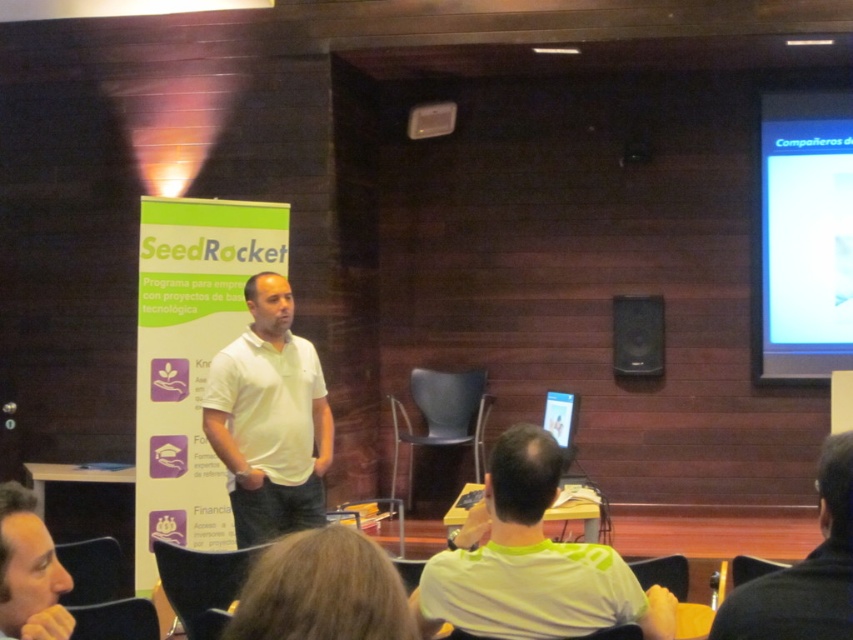
Question: Can you confirm if matte white projector screen at upper right is positioned to the right of black fabric shirt at lower right?

Choices:
 (A) no
 (B) yes

Answer: (B)

Question: Which object is positioned closest to the black fabric shirt at lower right?

Choices:
 (A) light brown hair at lower left
 (B) white matte shirt at center

Answer: (A)

Question: Which point is farther from the camera taking this photo?

Choices:
 (A) (621, 346)
 (B) (38, 544)
 (C) (434, 566)
 (D) (824, 493)

Answer: (A)

Question: Where is matte white projector screen at upper right located in relation to white matte shirt at center in the image?

Choices:
 (A) left
 (B) right

Answer: (B)

Question: Is the position of yellow matte shirt at center more distant than that of black plastic speaker at upper center?

Choices:
 (A) yes
 (B) no

Answer: (B)

Question: Which object appears closest to the camera in this image?

Choices:
 (A) black plastic speaker at upper center
 (B) black fabric shirt at lower right

Answer: (B)